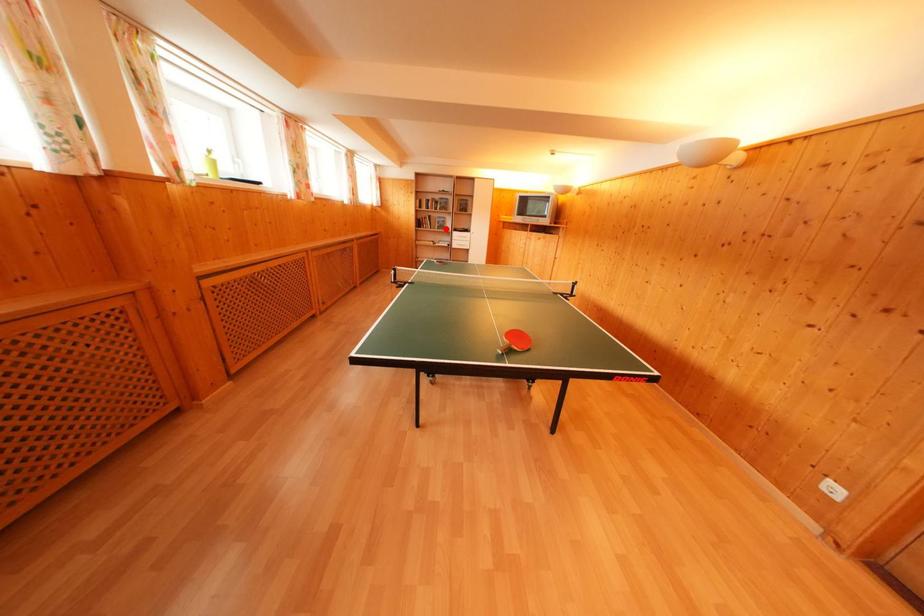
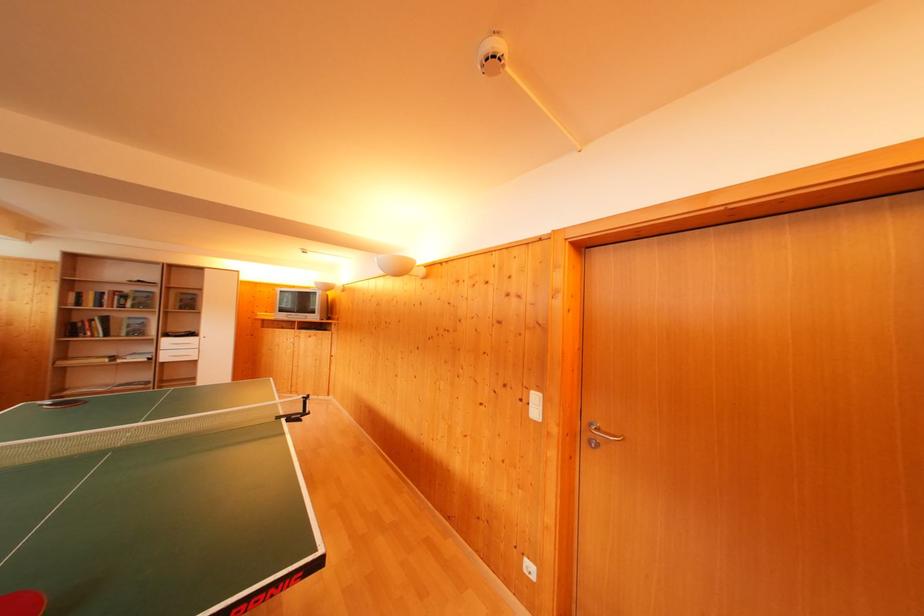
The point at the highlighted location is marked in the first image. Where is the corresponding point in the second image?

(140, 331)